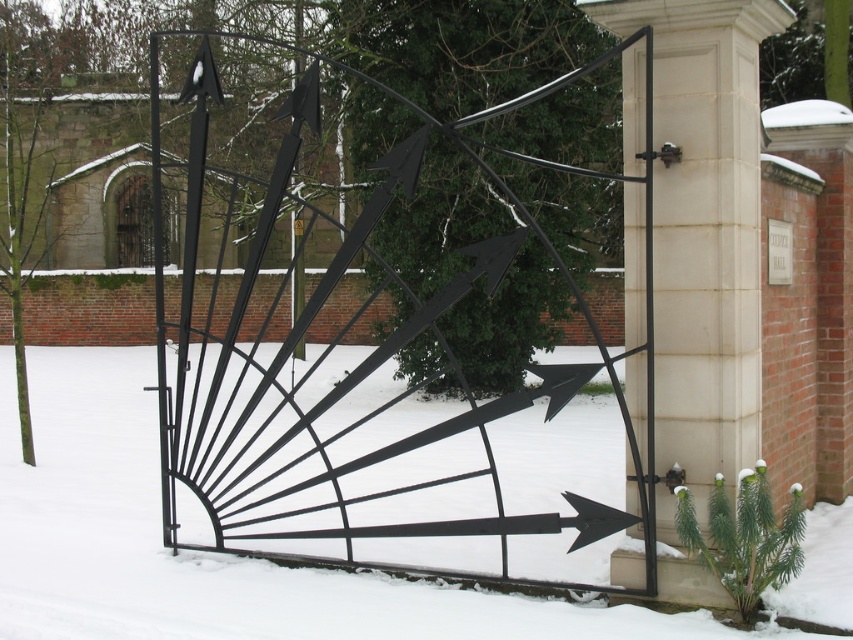
Question: Is white matte snow at center bigger than white stone pillar at center?

Choices:
 (A) no
 (B) yes

Answer: (B)

Question: Which point appears closest to the camera in this image?

Choices:
 (A) click(192, 621)
 (B) click(705, 248)

Answer: (B)

Question: Can you confirm if white matte snow at center is smaller than white stone pillar at center?

Choices:
 (A) yes
 (B) no

Answer: (B)

Question: Among these objects, which one is farthest from the camera?

Choices:
 (A) white stone pillar at center
 (B) white matte snow at center

Answer: (A)

Question: Does white matte snow at center have a greater width compared to white stone pillar at center?

Choices:
 (A) yes
 (B) no

Answer: (A)